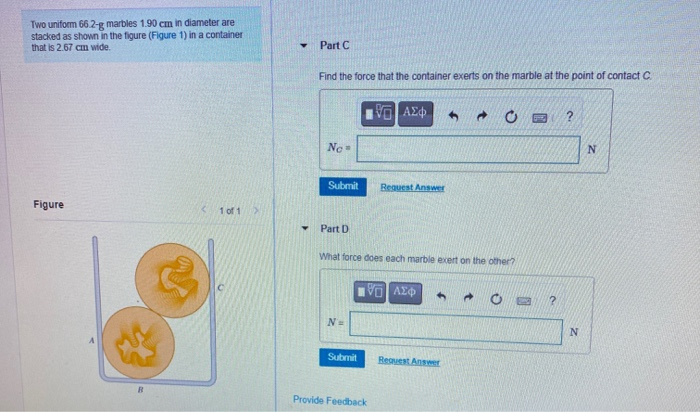
The width and height of the screenshot is (700, 412). Find the location of `keyboard button`. keyboard button is located at coordinates (542, 118), (521, 296).